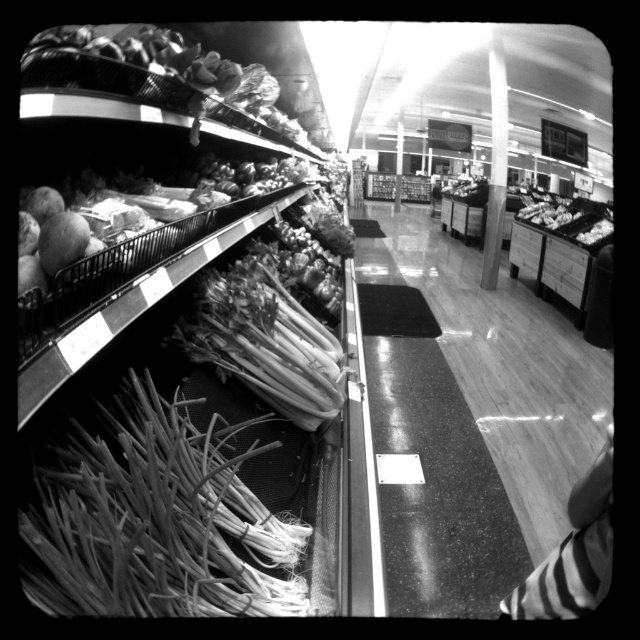
Does point (204, 480) come closer to viewer compared to point (241, 337)?

That is True.

What do you see at coordinates (156, 518) in the screenshot? The height and width of the screenshot is (640, 640). I see `smooth green onions at lower left` at bounding box center [156, 518].

Image resolution: width=640 pixels, height=640 pixels. What do you see at coordinates (156, 518) in the screenshot?
I see `smooth green onions at lower left` at bounding box center [156, 518].

At what (x,y) coordinates should I click in order to perform the action: click on smooth green onions at lower left. Please return your answer as a coordinate pair (x, y). Looking at the image, I should click on (156, 518).

Who is positioned more to the right, smooth glossy floor at center or smooth green onions at lower left?

smooth glossy floor at center is more to the right.

Does point (476, 276) lie in front of point (160, 490)?

That is False.

At what (x,y) coordinates should I click in order to perform the action: click on smooth glossy floor at center. Please return your answer as a coordinate pair (x, y). The image size is (640, 640). Looking at the image, I should click on (474, 420).

Is smooth glossy floor at center taller than smooth green onions at center?

No.

Is smooth glossy floor at center positioned before smooth green onions at center?

No, smooth glossy floor at center is further to the viewer.

Is point (554, 358) farther from viewer compared to point (214, 342)?

Yes.

Image resolution: width=640 pixels, height=640 pixels. Find the location of `smooth glossy floor at center`. smooth glossy floor at center is located at coordinates (474, 420).